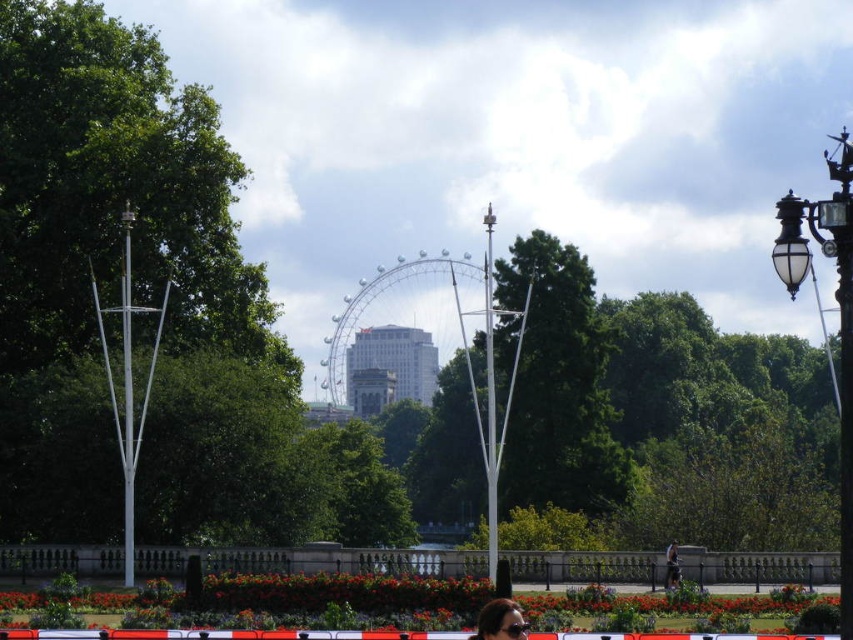
Between concrete barrier at lower center and matte black sunglasses at lower center, which one appears on the right side from the viewer's perspective?

From the viewer's perspective, matte black sunglasses at lower center appears more on the right side.

You are a GUI agent. You are given a task and a screenshot of the screen. Output one action in this format:
    pyautogui.click(x=<x>, y=<y>)
    Task: Click on the concrete barrier at lower center
    Image resolution: width=853 pixels, height=640 pixels.
    Given the screenshot: What is the action you would take?
    pyautogui.click(x=312, y=561)

Who is more forward, (x=744, y=566) or (x=517, y=625)?

Point (x=517, y=625) is more forward.

Find the location of `concrete barrier at lower center`. concrete barrier at lower center is located at coordinates (312, 561).